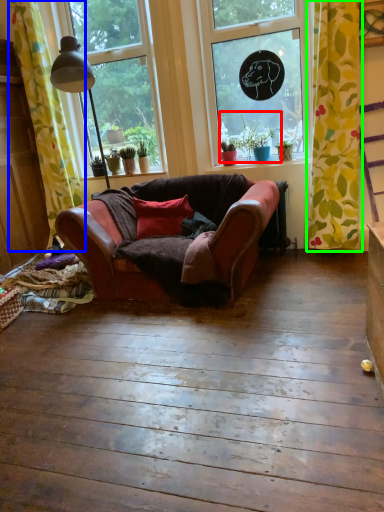
Question: Which object is the closest to the plant (highlighted by a red box)? Choose among these: curtain (highlighted by a blue box) or curtain (highlighted by a green box).

Choices:
 (A) curtain
 (B) curtain

Answer: (B)